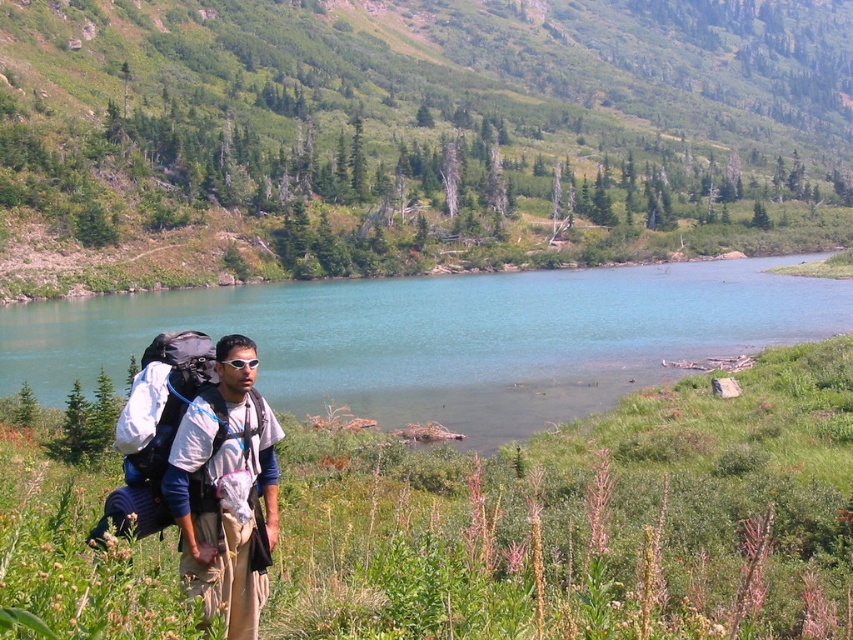
Can you confirm if green grassy hillside at upper center is thinner than matte black backpack at lower left?

No.

Who is shorter, green grassy hillside at upper center or matte black backpack at lower left?

With less height is matte black backpack at lower left.

Is point (354, 172) in front of point (151, 444)?

No, (354, 172) is behind (151, 444).

Locate an element on the screen. The image size is (853, 640). green grassy hillside at upper center is located at coordinates (410, 136).

Is green grassy hillside at upper center above clear blue water at center?

Yes.

Is green grassy hillside at upper center taller than clear blue water at center?

Yes, green grassy hillside at upper center is taller than clear blue water at center.

What do you see at coordinates (410, 136) in the screenshot? I see `green grassy hillside at upper center` at bounding box center [410, 136].

You are a GUI agent. You are given a task and a screenshot of the screen. Output one action in this format:
    pyautogui.click(x=<x>, y=<y>)
    Task: Click on the green grassy hillside at upper center
    Image resolution: width=853 pixels, height=640 pixels.
    Given the screenshot: What is the action you would take?
    pyautogui.click(x=410, y=136)

Between white fabric backpack at center and matte black backpack at lower left, which one appears on the right side from the viewer's perspective?

white fabric backpack at center is more to the right.

Between white fabric backpack at center and matte black backpack at lower left, which one is positioned lower?

white fabric backpack at center is below.

Between point (241, 632) and point (120, 440), which one is positioned in front?

Positioned in front is point (241, 632).

Find the location of `white fabric backpack at center`. white fabric backpack at center is located at coordinates (225, 490).